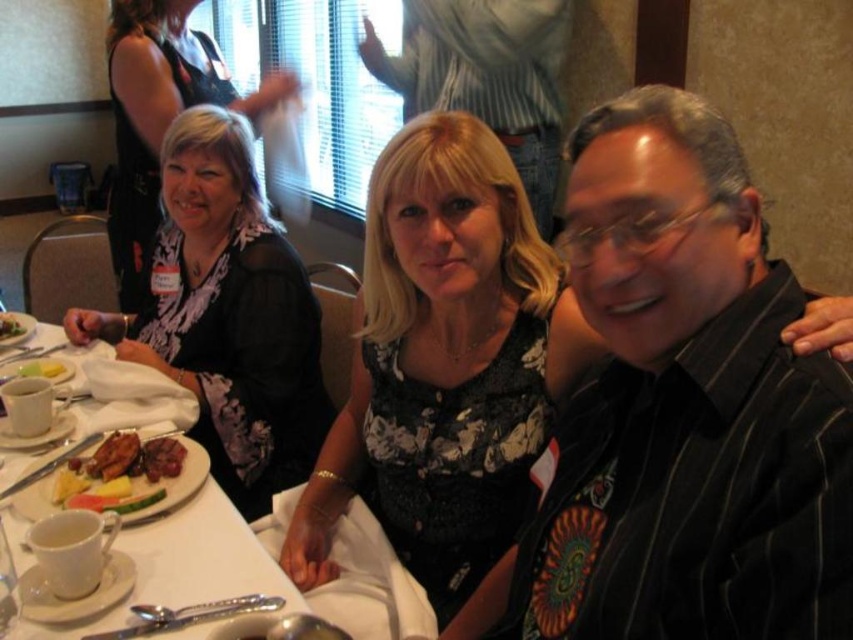
Question: Does golden brown meat at center come in front of yellow butter at table left?

Choices:
 (A) no
 (B) yes

Answer: (B)

Question: Which object is farther from the camera taking this photo?

Choices:
 (A) black striped shirt at right
 (B) yellow butter at table left

Answer: (B)

Question: Is black sheer dress at left thinner than white porcelain plate at left?

Choices:
 (A) no
 (B) yes

Answer: (A)

Question: Is matte black dress at left smaller than yellow butter at table left?

Choices:
 (A) yes
 (B) no

Answer: (B)

Question: Which object is the closest to the matte black dress at left?

Choices:
 (A) golden brown meat at center
 (B) white porcelain plate at left

Answer: (A)

Question: Estimate the real-world distances between objects in this image. Which object is farther from the black sheer dress at left?

Choices:
 (A) golden brown meat at center
 (B) yellow butter at table left
 (C) white porcelain plate at lower left
 (D) white porcelain plate at left

Answer: (D)